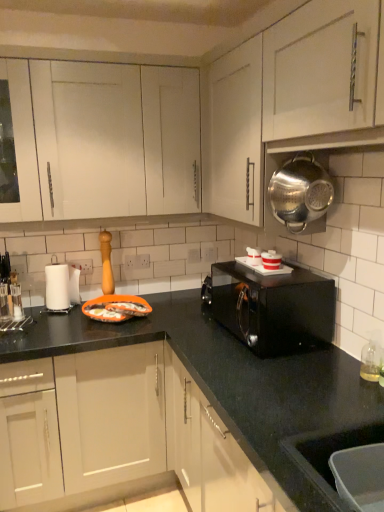
Question: Is matte white cabinets at center, arranged as the 1th cabinetry when ordered from the bottom, placed right next to white glossy microwave at upper right, marked as the third appliance in a top-to-bottom arrangement?

Choices:
 (A) no
 (B) yes

Answer: (A)

Question: Is matte white cabinets at center, arranged as the 1th cabinetry when ordered from the bottom, completely or partially outside of white glossy microwave at upper right, the 2th appliance viewed from the front?

Choices:
 (A) yes
 (B) no

Answer: (A)

Question: Is matte white cabinets at center, the second cabinetry viewed from the top, further to the viewer compared to white glossy microwave at upper right, positioned as the 2th appliance in right-to-left order?

Choices:
 (A) no
 (B) yes

Answer: (A)

Question: Is matte white cabinets at center, arranged as the 1th cabinetry when ordered from the bottom, facing away from white glossy microwave at upper right, the 2th appliance viewed from the front?

Choices:
 (A) no
 (B) yes

Answer: (A)

Question: Is matte white cabinets at center, arranged as the 1th cabinetry when ordered from the bottom, smaller than white glossy microwave at upper right, the second appliance from the bottom?

Choices:
 (A) yes
 (B) no

Answer: (B)

Question: Is black matte microwave oven at center in front of or behind white paper towel at left, which is the fourth appliance in top-to-bottom order, in the image?

Choices:
 (A) behind
 (B) front

Answer: (B)

Question: From a real-world perspective, is black matte microwave oven at center physically located above or below white paper towel at left, which ranks as the fourth appliance in right-to-left order?

Choices:
 (A) below
 (B) above

Answer: (B)

Question: Is point (291, 271) closer or farther from the camera than point (59, 275)?

Choices:
 (A) closer
 (B) farther

Answer: (A)

Question: From the image's perspective, is black matte microwave oven at center located above or below white paper towel at left, which is counted as the 1th appliance, starting from the left?

Choices:
 (A) below
 (B) above

Answer: (A)

Question: Considering the positions of metallic silver pot at upper right, which is counted as the 2th cabinetry, starting from the bottom, and white glossy microwave at upper right, the 2th appliance viewed from the front, in the image, is metallic silver pot at upper right, which is counted as the 2th cabinetry, starting from the bottom, wider or thinner than white glossy microwave at upper right, the 2th appliance viewed from the front,?

Choices:
 (A) thin
 (B) wide

Answer: (B)

Question: In terms of height, does metallic silver pot at upper right, which is counted as the 2th cabinetry, starting from the bottom, look taller or shorter compared to white glossy microwave at upper right, positioned as the 2th appliance in right-to-left order?

Choices:
 (A) tall
 (B) short

Answer: (A)

Question: From a real-world perspective, is metallic silver pot at upper right, marked as the 1th cabinetry in a top-to-bottom arrangement, above or below white glossy microwave at upper right, marked as the third appliance in a top-to-bottom arrangement?

Choices:
 (A) above
 (B) below

Answer: (A)

Question: Relative to white glossy microwave at upper right, positioned as the 2th appliance in right-to-left order, is metallic silver pot at upper right, which is counted as the 2th cabinetry, starting from the bottom, in front or behind?

Choices:
 (A) front
 (B) behind

Answer: (A)

Question: From a real-world perspective, is white glossy microwave at upper right, the 2th appliance viewed from the front, above or below white paper towel at left, which is the 1th appliance in back-to-front order?

Choices:
 (A) above
 (B) below

Answer: (A)

Question: Visually, is white glossy microwave at upper right, acting as the third appliance starting from the left, positioned to the left or to the right of white paper towel at left, which is counted as the 1th appliance, starting from the left?

Choices:
 (A) left
 (B) right

Answer: (B)